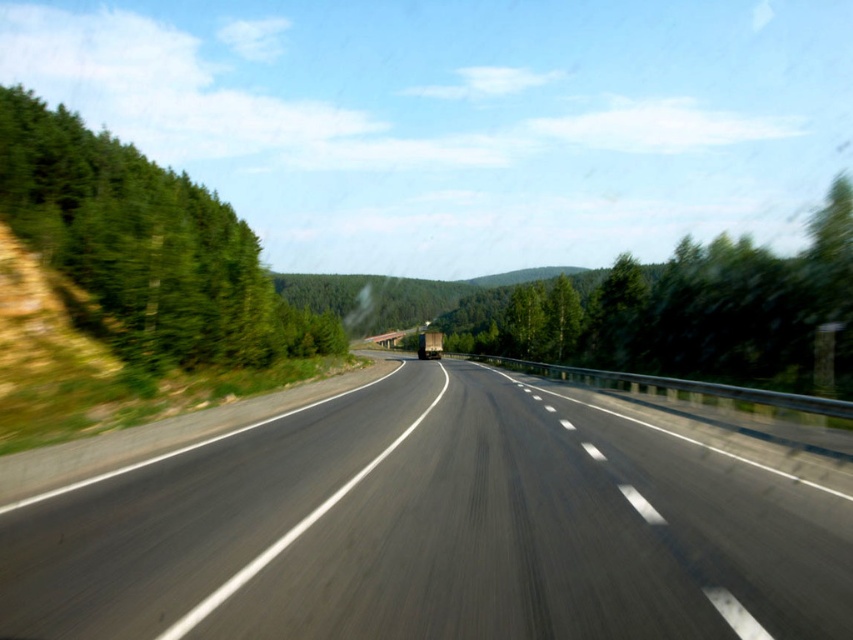
Between black asphalt highway at center and green leafy trees at left, which one appears on the right side from the viewer's perspective?

black asphalt highway at center

Between point (457, 570) and point (64, 218), which one is positioned in front?

Positioned in front is point (457, 570).

This screenshot has height=640, width=853. What are the coordinates of `black asphalt highway at center` in the screenshot? It's located at (434, 529).

Where is `black asphalt highway at center`? The height and width of the screenshot is (640, 853). black asphalt highway at center is located at coordinates (434, 529).

Does green leafy trees at left have a greater height compared to green leafy tree at center?

In fact, green leafy trees at left may be shorter than green leafy tree at center.

Can you confirm if green leafy trees at left is positioned above green leafy tree at center?

No, green leafy trees at left is not above green leafy tree at center.

Is point (157, 193) positioned behind point (675, 296)?

That is True.

Where is `green leafy trees at left`? Image resolution: width=853 pixels, height=640 pixels. green leafy trees at left is located at coordinates [x=144, y=250].

Which is below, black asphalt highway at center or green leafy tree at center?

black asphalt highway at center is below.

Is point (642, 577) positioned before point (758, 284)?

Yes, it is.

Locate an element on the screen. The image size is (853, 640). black asphalt highway at center is located at coordinates (434, 529).